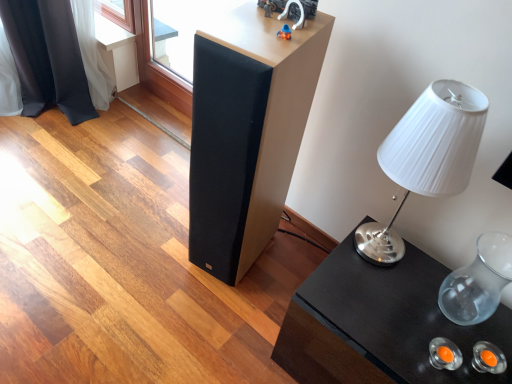
Question: Can you confirm if transparent glass vase at right is positioned to the right of white pleated fabric lampshade at right?

Choices:
 (A) yes
 (B) no

Answer: (A)

Question: Is transparent glass vase at right smaller than white pleated fabric lampshade at right?

Choices:
 (A) no
 (B) yes

Answer: (B)

Question: Is transparent glass vase at right facing away from white pleated fabric lampshade at right?

Choices:
 (A) no
 (B) yes

Answer: (A)

Question: Is the depth of transparent glass vase at right greater than that of white pleated fabric lampshade at right?

Choices:
 (A) yes
 (B) no

Answer: (A)

Question: Does transparent glass vase at right have a lesser width compared to white pleated fabric lampshade at right?

Choices:
 (A) yes
 (B) no

Answer: (A)

Question: Is transparent glass vase at right in contact with white pleated fabric lampshade at right?

Choices:
 (A) no
 (B) yes

Answer: (A)

Question: Is transparent glass vase at right oriented away from matte black speaker at center?

Choices:
 (A) yes
 (B) no

Answer: (B)

Question: From a real-world perspective, is transparent glass vase at right on top of matte black speaker at center?

Choices:
 (A) no
 (B) yes

Answer: (A)

Question: Is transparent glass vase at right aimed at matte black speaker at center?

Choices:
 (A) yes
 (B) no

Answer: (B)

Question: From a real-world perspective, is transparent glass vase at right positioned under matte black speaker at center based on gravity?

Choices:
 (A) no
 (B) yes

Answer: (B)

Question: Can you confirm if transparent glass vase at right is bigger than matte black speaker at center?

Choices:
 (A) no
 (B) yes

Answer: (A)

Question: Can you confirm if transparent glass vase at right is smaller than matte black speaker at center?

Choices:
 (A) no
 (B) yes

Answer: (B)

Question: Is black glossy table at lower right wider than matte black speaker at center?

Choices:
 (A) yes
 (B) no

Answer: (A)